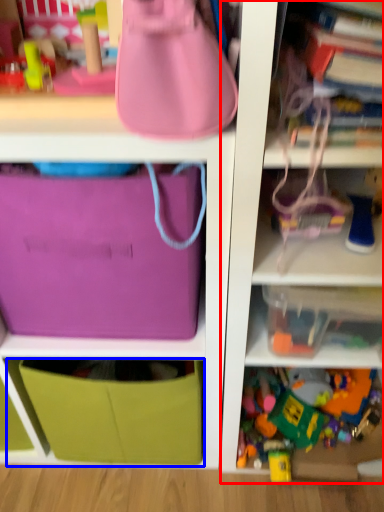
Question: Which of the following is the farthest to the observer, shelf (highlighted by a red box) or drawer (highlighted by a blue box)?

Choices:
 (A) shelf
 (B) drawer

Answer: (B)